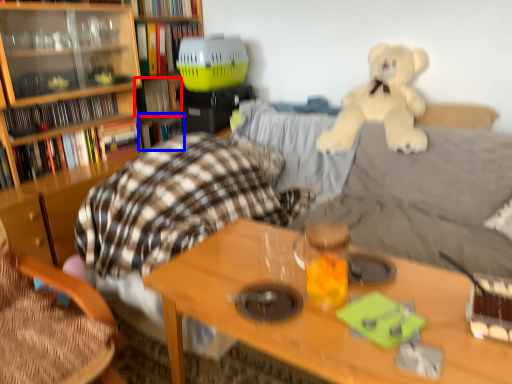
Question: Which object appears closest to the camera in this image, book (highlighted by a red box) or book (highlighted by a blue box)?

Choices:
 (A) book
 (B) book

Answer: (A)